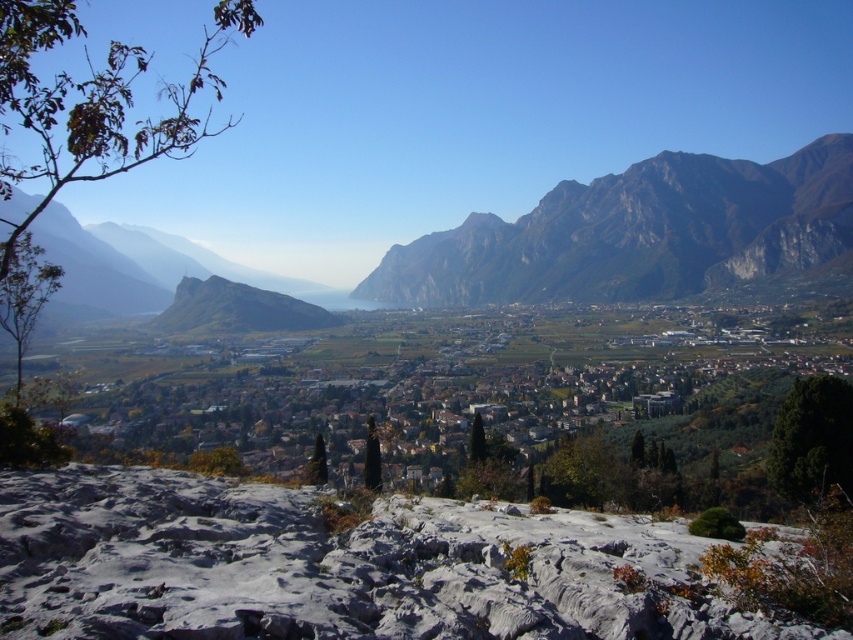
Looking at this image, you are standing at the point labeled point (181, 500) and want to take a photo of the point labeled point (395, 296). Based on the scene description, will the point you are standing at appear in the foreground or background of the photo?

The point labeled point (181, 500) is closer to the viewer than point (395, 296). Therefore, the point you are standing at will appear in the foreground of the photo.